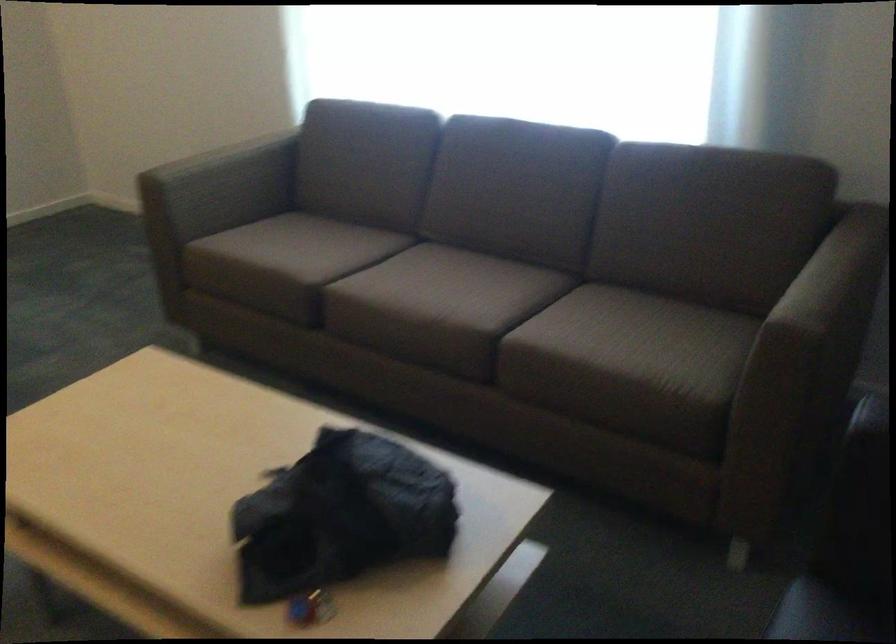
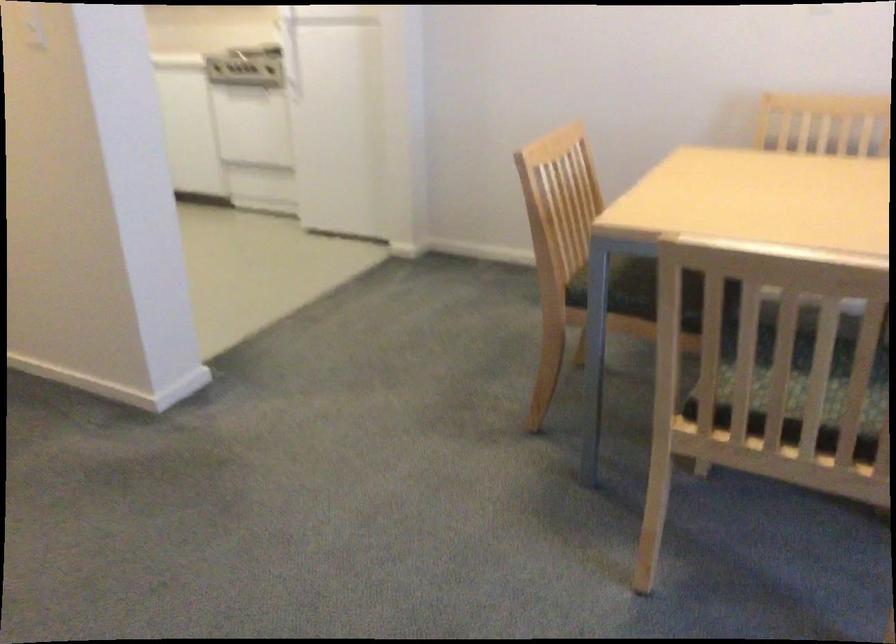
How did the camera likely rotate?

The camera rotated toward left-down.